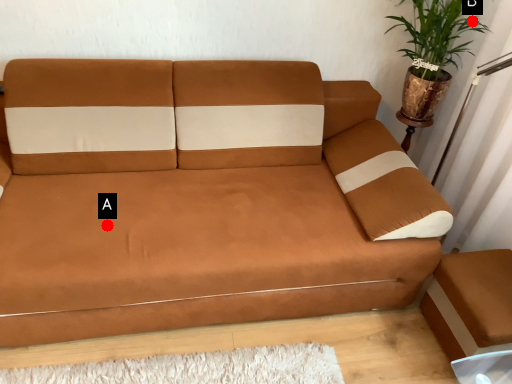
Question: Two points are circled on the image, labeled by A and B beside each circle. Which point is farther to the camera?

Choices:
 (A) A is further
 (B) B is further

Answer: (B)